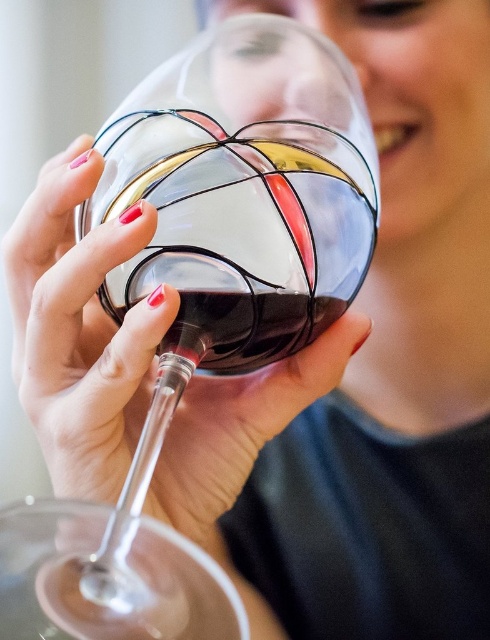
Is clear glass wine glass at center below dark glass wine at center?

Indeed, clear glass wine glass at center is positioned under dark glass wine at center.

The height and width of the screenshot is (640, 490). What are the coordinates of `clear glass wine glass at center` in the screenshot? It's located at (198, 256).

Where is `clear glass wine glass at center`? This screenshot has width=490, height=640. clear glass wine glass at center is located at coordinates (198, 256).